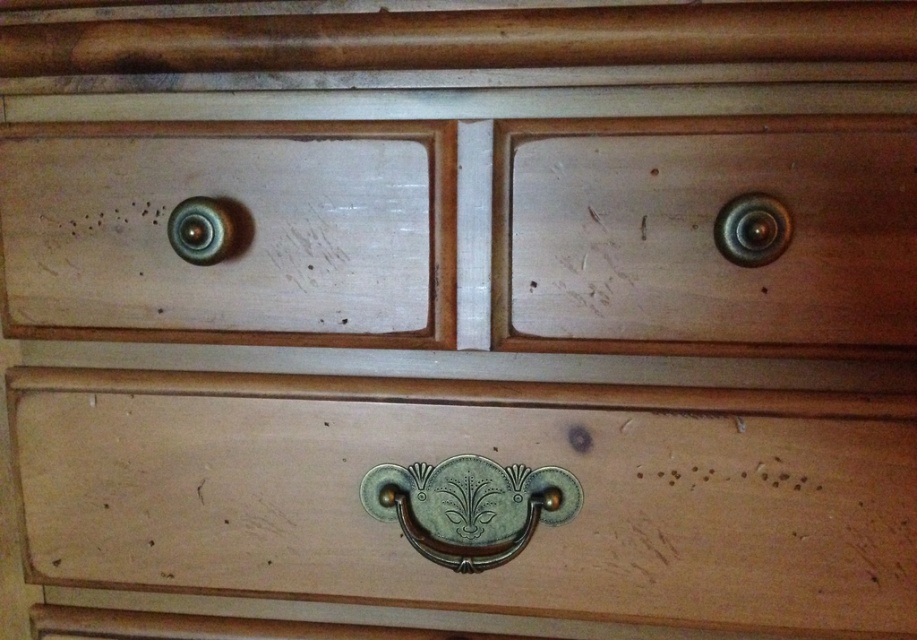
Is matte wood drawer at left thinner than metallic brass knob at upper left?

No, matte wood drawer at left is not thinner than metallic brass knob at upper left.

Which is above, matte wood drawer at left or metallic brass knob at upper left?

metallic brass knob at upper left is higher up.

Does point (235, 129) lie behind point (194, 259)?

No, it is in front of (194, 259).

Identify the location of matte wood drawer at left. coord(235,232).

Is matte wood drawer at bottom above metallic brass knob at upper left?

No, matte wood drawer at bottom is not above metallic brass knob at upper left.

Which is in front, point (483, 445) or point (173, 243)?

Positioned in front is point (173, 243).

Describe the element at coordinates (490, 458) in the screenshot. Image resolution: width=917 pixels, height=640 pixels. I see `matte wood drawer at bottom` at that location.

Identify the location of matte wood drawer at bottom. (490, 458).

Locate an element on the screen. light wood drawer at right is located at coordinates (704, 234).

Who is more forward, (796, 228) or (201, 198)?

Point (796, 228) is more forward.

Image resolution: width=917 pixels, height=640 pixels. What are the coordinates of `light wood drawer at right` in the screenshot? It's located at (704, 234).